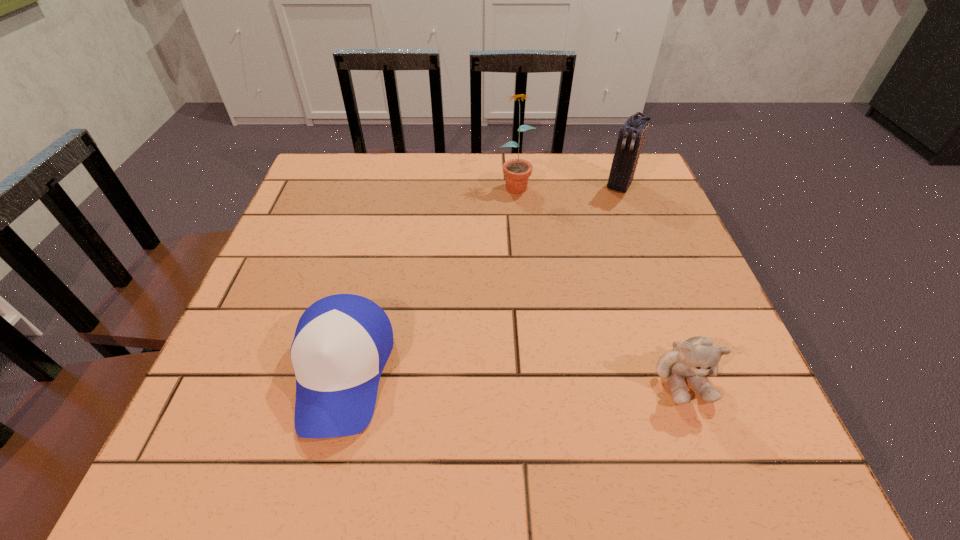
Find the location of a particular element. Image resolution: width=960 pixels, height=540 pixels. the second closest object to the third shortest object is located at coordinates (696, 357).